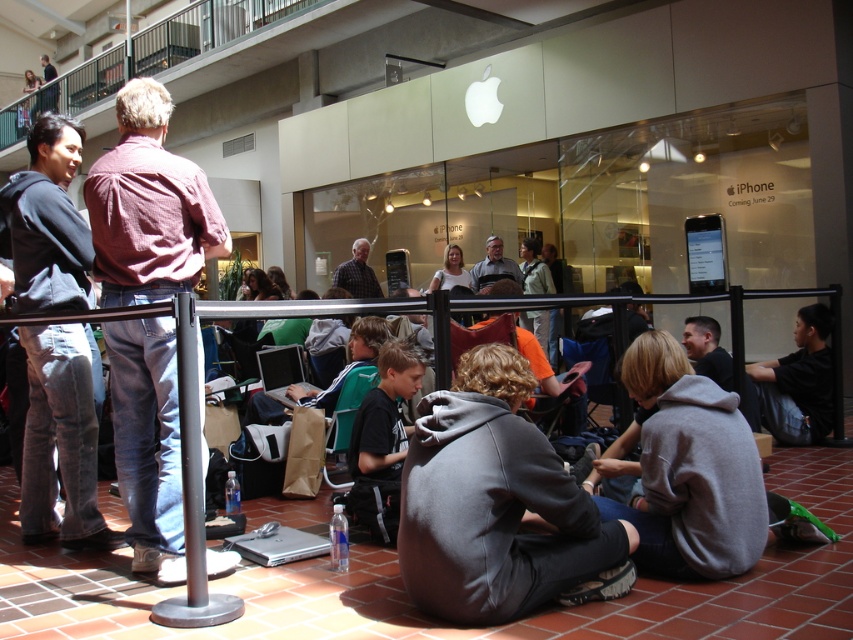
Can you confirm if gray hoodie at lower center is positioned below white fabric shirt at center?

Indeed, gray hoodie at lower center is positioned under white fabric shirt at center.

Who is positioned more to the left, gray hoodie at lower center or white fabric shirt at center?

Positioned to the left is white fabric shirt at center.

Find the location of a particular element. gray hoodie at lower center is located at coordinates point(686,468).

Between gray hoodie at lower center and plaid shirt at center, which one is positioned lower?

gray hoodie at lower center is below.

Can you confirm if gray hoodie at lower center is bigger than plaid shirt at center?

Yes.

Locate an element on the screen. gray hoodie at lower center is located at coordinates (686, 468).

Where is `gray hoodie at lower center`? The width and height of the screenshot is (853, 640). gray hoodie at lower center is located at coordinates (686, 468).

Can you confirm if gray sweatpants at center is bigger than plaid shirt at center?

Yes, gray sweatpants at center is bigger than plaid shirt at center.

Between point (74, 285) and point (357, 250), which one is positioned in front?

Point (74, 285) is more forward.

Is point (85, 348) positioned in front of point (349, 276)?

Yes, it is.

What are the coordinates of `gray sweatpants at center` in the screenshot? It's located at (61, 440).